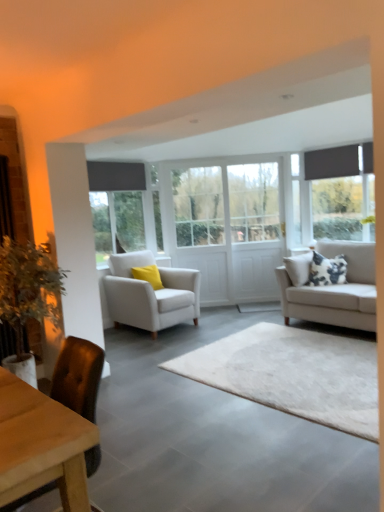
Question: In which direction should I rotate to look at white fabric armchair at center, the 2th chair from the front?

Choices:
 (A) right
 (B) left

Answer: (B)

Question: Should I look upward or downward to see matte gray window at center, the 1th window when ordered from left to right?

Choices:
 (A) down
 (B) up

Answer: (B)

Question: Is white soft rug at center positioned far away from clear glass door at center, placed as the second glass door when sorted from right to left?

Choices:
 (A) no
 (B) yes

Answer: (B)

Question: Is the position of white soft rug at center more distant than that of clear glass door at center, which is the first glass door from left to right?

Choices:
 (A) no
 (B) yes

Answer: (A)

Question: From a real-world perspective, is white soft rug at center under clear glass door at center, which is the first glass door from left to right?

Choices:
 (A) yes
 (B) no

Answer: (A)

Question: Is white soft rug at center positioned with its back to clear glass door at center, which is the first glass door from left to right?

Choices:
 (A) yes
 (B) no

Answer: (B)

Question: Is white soft rug at center closer to camera compared to clear glass door at center, placed as the second glass door when sorted from right to left?

Choices:
 (A) no
 (B) yes

Answer: (B)

Question: From the image's perspective, is white soft rug at center beneath clear glass door at center, placed as the second glass door when sorted from right to left?

Choices:
 (A) no
 (B) yes

Answer: (B)

Question: From the image's perspective, would you say brown leather chair at lower left, the 2th chair viewed from the back, is shown under white glass door at center, the first glass door in the right-to-left sequence?

Choices:
 (A) yes
 (B) no

Answer: (A)

Question: Is brown leather chair at lower left, the 2th chair viewed from the back, directly adjacent to white glass door at center, the first glass door in the right-to-left sequence?

Choices:
 (A) no
 (B) yes

Answer: (A)

Question: Would you consider brown leather chair at lower left, the 1th chair when ordered from front to back, to be distant from white glass door at center, the second glass door positioned from the left?

Choices:
 (A) no
 (B) yes

Answer: (B)

Question: Is brown leather chair at lower left, the 2th chair viewed from the back, in front of white glass door at center, the first glass door in the right-to-left sequence?

Choices:
 (A) yes
 (B) no

Answer: (A)

Question: From a real-world perspective, is brown leather chair at lower left, the 2th chair viewed from the back, positioned under white glass door at center, the second glass door positioned from the left, based on gravity?

Choices:
 (A) yes
 (B) no

Answer: (A)

Question: Is brown leather chair at lower left, the 1th chair when ordered from front to back, thinner than white glass door at center, the first glass door in the right-to-left sequence?

Choices:
 (A) yes
 (B) no

Answer: (B)

Question: From the image's perspective, is light gray fabric couch at right located above white soft rug at center?

Choices:
 (A) yes
 (B) no

Answer: (A)